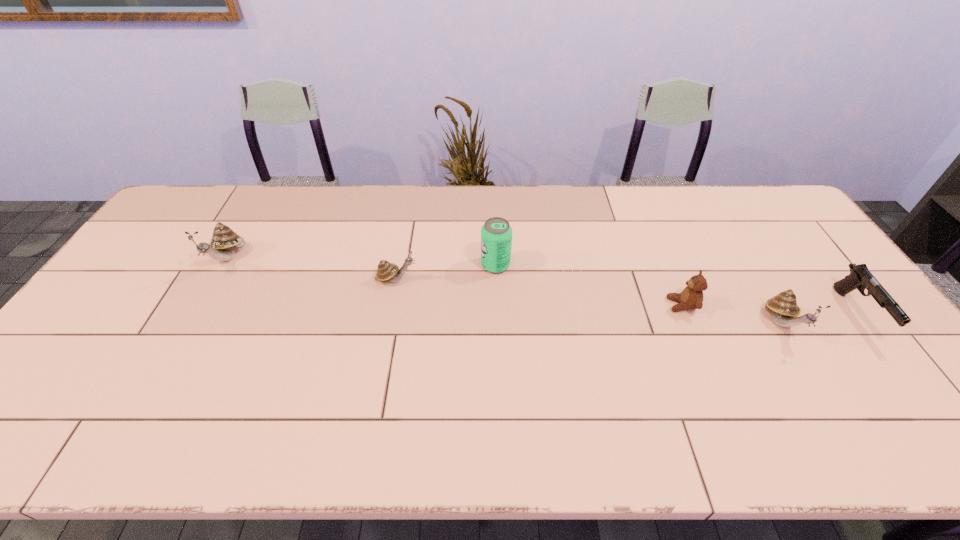
The width and height of the screenshot is (960, 540). I want to click on the leftmost object, so click(224, 242).

The height and width of the screenshot is (540, 960). I want to click on the second snail from left to right, so click(x=386, y=271).

Find the location of a particular element. This screenshot has height=540, width=960. the fifth object from right to left is located at coordinates pyautogui.click(x=386, y=271).

Where is `the second object from right to left`? the second object from right to left is located at coordinates (783, 306).

Locate an element on the screen. Image resolution: width=960 pixels, height=540 pixels. the rightmost snail is located at coordinates (783, 306).

The width and height of the screenshot is (960, 540). I want to click on pop soda, so click(496, 234).

This screenshot has width=960, height=540. What are the coordinates of `the third object from right to left` in the screenshot? It's located at (691, 297).

Locate an element on the screen. The image size is (960, 540). gun is located at coordinates (860, 277).

Locate an element on the screen. The width and height of the screenshot is (960, 540). vacant space located 0.220m on the face of the leftmost snail is located at coordinates tap(181, 341).

This screenshot has height=540, width=960. What are the coordinates of `vacant region located on the face of the second snail from left to right` in the screenshot? It's located at (523, 279).